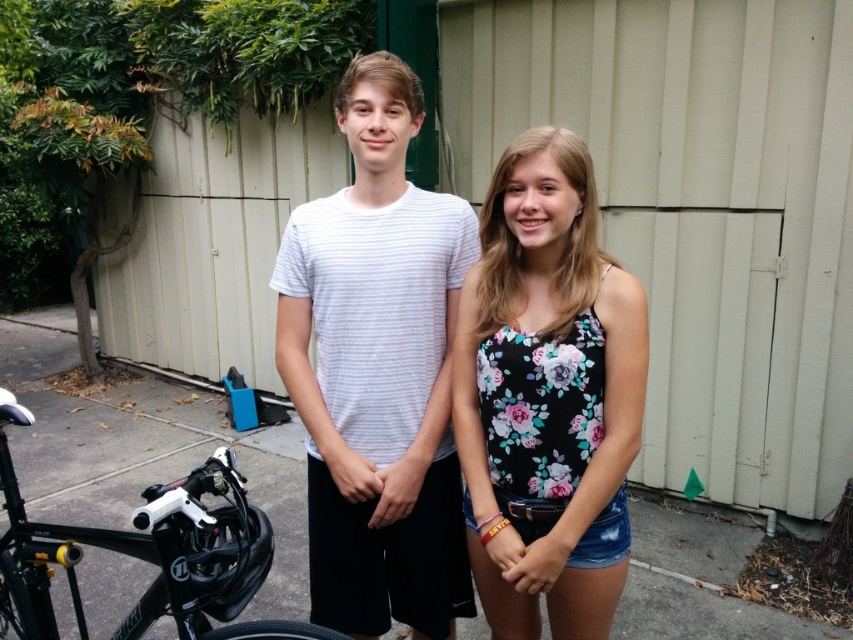
Locate an element on the screen. The height and width of the screenshot is (640, 853). white striped t-shirt at center is located at coordinates (378, 371).

Consider the image. Who is more distant from viewer, (375, 444) or (573, 397)?

The point (375, 444) is behind.

This screenshot has width=853, height=640. Find the location of `white striped t-shirt at center`. white striped t-shirt at center is located at coordinates (378, 371).

Which of these two, floral print tank top at center or gray concrete pavement at center, stands shorter?

gray concrete pavement at center

Is floral print tank top at center wider than gray concrete pavement at center?

No, floral print tank top at center is not wider than gray concrete pavement at center.

Is point (519, 177) closer to camera compared to point (187, 461)?

Yes, it is.

Where is `floral print tank top at center`? This screenshot has width=853, height=640. floral print tank top at center is located at coordinates (547, 396).

Who is lower down, gray concrete pavement at center or black matte bicycle at lower left?

black matte bicycle at lower left is below.

Which is behind, point (109, 454) or point (315, 625)?

The point (109, 454) is more distant.

I want to click on gray concrete pavement at center, so click(x=143, y=449).